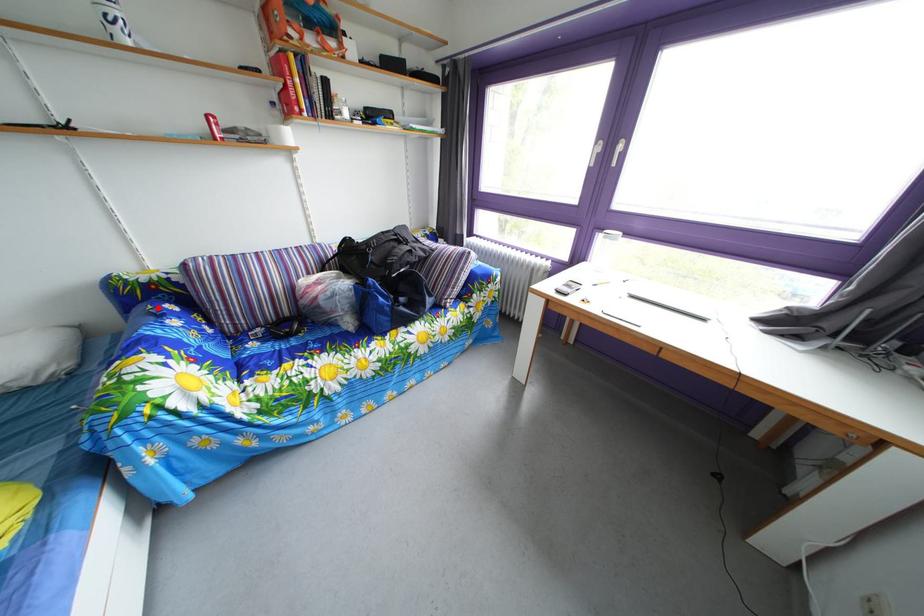
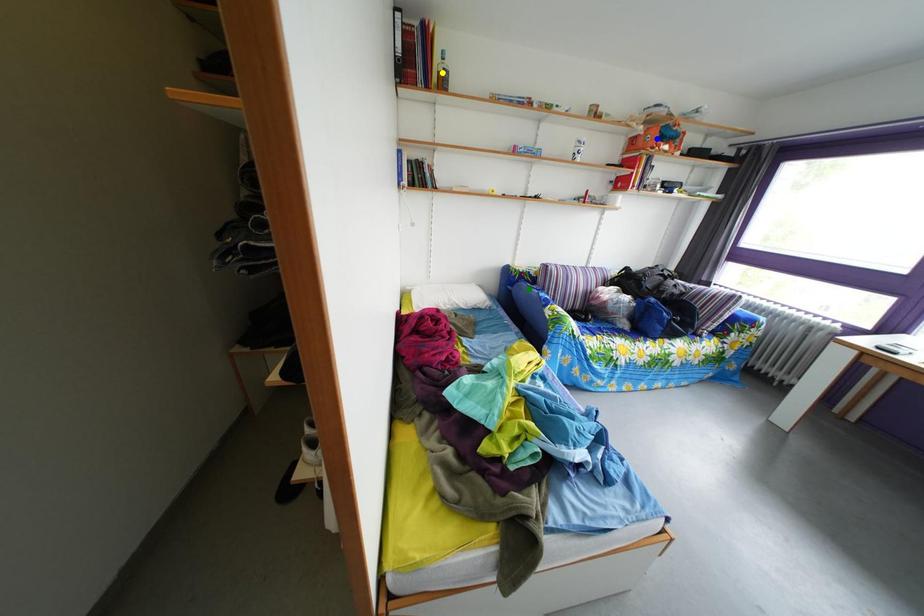
Question: I am providing you with two images of the same scene from different viewpoints. A red point is marked on the first image. You are given multiple points on the second image. Which mark in image 2 goes with the point in image 1?

Choices:
 (A) green point
 (B) blue point
 (C) yellow point

Answer: (A)